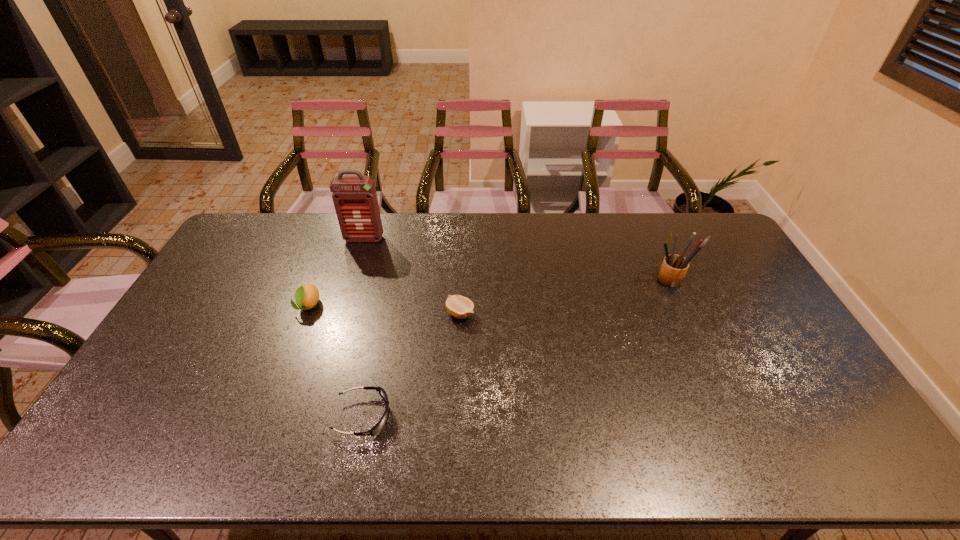
Where is `object that stands as the closest to the rightmost object`? The height and width of the screenshot is (540, 960). object that stands as the closest to the rightmost object is located at coordinates (460, 307).

The width and height of the screenshot is (960, 540). I want to click on the third closest object to the taller lemon, so click(460, 307).

This screenshot has height=540, width=960. I want to click on free space that satisfies the following two spatial constraints: 1. on the back side of the right lemon; 2. on the right side of the second tallest object, so click(462, 280).

In order to click on vacant area in the image that satisfies the following two spatial constraints: 1. with leaves positioned above the leftmost object; 2. on the right side of the right lemon in this screenshot , I will do `click(305, 314)`.

Where is `free region that satisfies the following two spatial constraints: 1. with leaves positioned above the right lemon; 2. on the left side of the third shortest object`? The width and height of the screenshot is (960, 540). free region that satisfies the following two spatial constraints: 1. with leaves positioned above the right lemon; 2. on the left side of the third shortest object is located at coordinates (305, 314).

Locate an element on the screen. This screenshot has height=540, width=960. blank area in the image that satisfies the following two spatial constraints: 1. with leaves positioned above the left lemon; 2. on the left side of the second object from right to left is located at coordinates (305, 314).